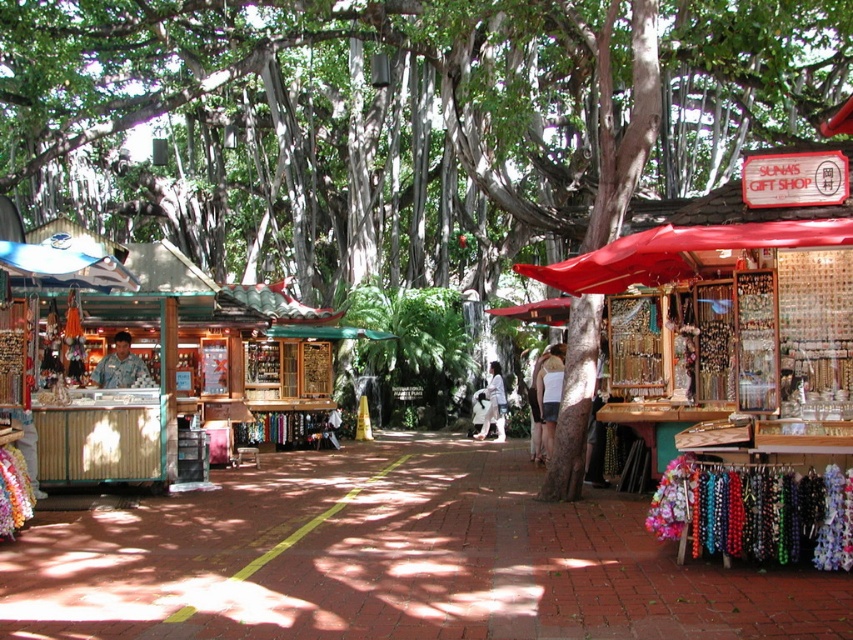
Question: Which point is farther to the camera?

Choices:
 (A) red fabric umbrella at right
 (B) white fabric at center
 (C) camouflage uniform at center

Answer: (B)

Question: Which object is positioned farthest from the camouflage uniform at center?

Choices:
 (A) white fabric at center
 (B) white cotton shirt at center
 (C) red fabric umbrella at right

Answer: (A)

Question: Which object is closer to the camera taking this photo?

Choices:
 (A) light brown leather jacket at center
 (B) red fabric umbrella at right
 (C) camouflage uniform at center
 (D) white cotton shirt at center

Answer: (B)

Question: Considering the relative positions of white cotton shirt at center and light brown leather jacket at center in the image provided, where is white cotton shirt at center located with respect to light brown leather jacket at center?

Choices:
 (A) left
 (B) right

Answer: (A)

Question: Is red fabric umbrella at right closer to camera compared to white fabric at center?

Choices:
 (A) yes
 (B) no

Answer: (A)

Question: Is white cotton shirt at center below camouflage uniform at center?

Choices:
 (A) no
 (B) yes

Answer: (B)